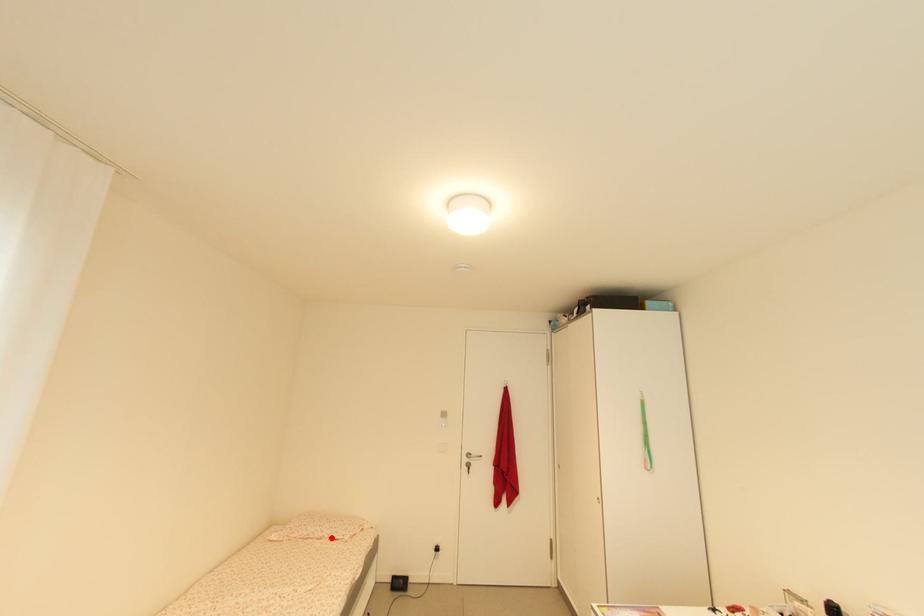
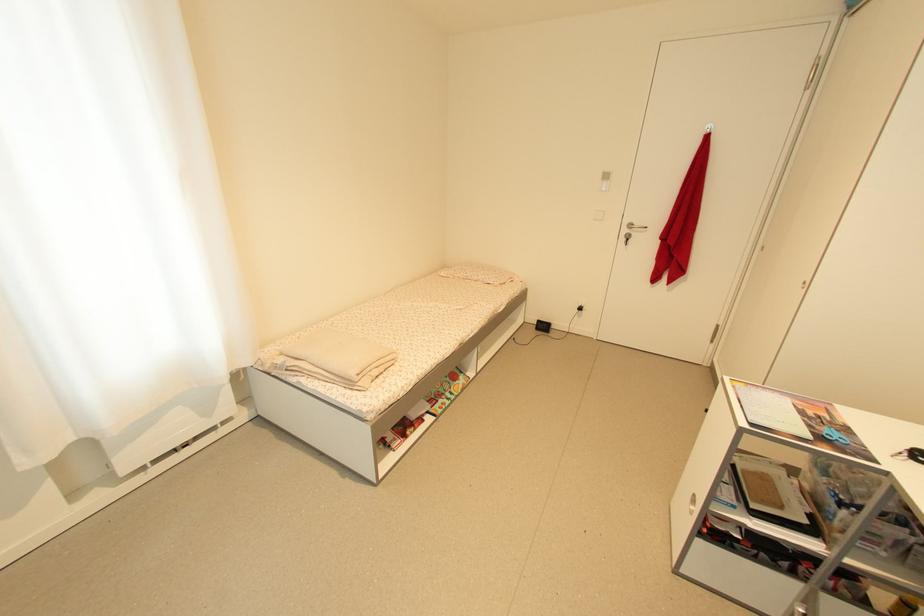
Question: I am providing you with two images of the same scene from different viewpoints. Given a red point in image1, look at the same physical point in image2. Is it:

Choices:
 (A) Closer to the viewpoint
 (B) Farther from the viewpoint

Answer: (A)